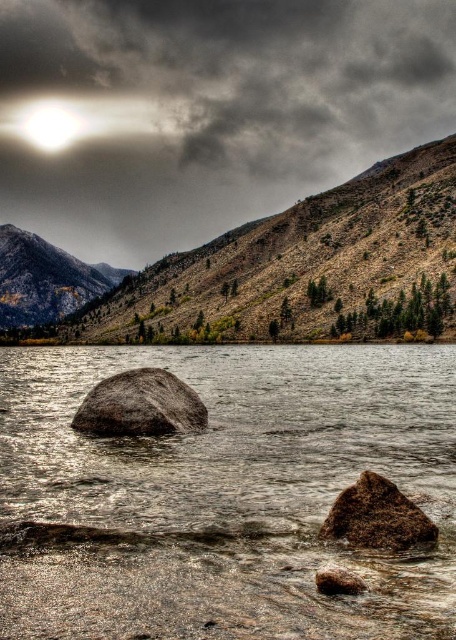
Who is more distant from viewer, (269, 426) or (395, 8)?

The point (395, 8) is behind.

Which is more to the left, smooth gray rock at center or dark gray cloud at upper center?

dark gray cloud at upper center

Locate an element on the screen. This screenshot has width=456, height=640. smooth gray rock at center is located at coordinates tap(223, 493).

Who is more distant from viewer, [196,92] or [351,584]?

The point [196,92] is more distant.

Is dark gray cloud at upper center to the right of brown rough rock at lower center from the viewer's perspective?

In fact, dark gray cloud at upper center is to the left of brown rough rock at lower center.

Is point (193, 44) positioned behind point (328, 586)?

Yes, it is.

The width and height of the screenshot is (456, 640). Find the location of `dark gray cloud at upper center`. dark gray cloud at upper center is located at coordinates (210, 109).

Can you confirm if smooth gray rock at center is wider than bright white light at upper left?

Yes, smooth gray rock at center is wider than bright white light at upper left.

Which is in front, point (314, 531) or point (37, 106)?

Point (314, 531)

Locate an element on the screen. This screenshot has width=456, height=640. smooth gray rock at center is located at coordinates (223, 493).